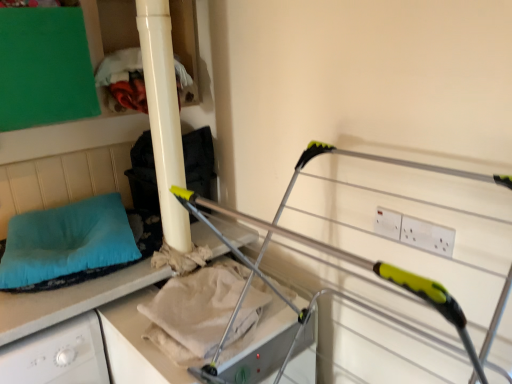
The image size is (512, 384). I want to click on beige cotton sheet at center, so click(x=194, y=312).

Measure the distance between point (135, 259) and camera.

The distance of point (135, 259) from camera is 4.75 feet.

This screenshot has height=384, width=512. Find the location of `metallic silver drying rack at center`. metallic silver drying rack at center is located at coordinates (361, 257).

Is matte white pillar at upper left not within teal fabric pillow at left?

matte white pillar at upper left lies outside teal fabric pillow at left's area.

Between matte white pillar at upper left and teal fabric pillow at left, which one appears on the right side from the viewer's perspective?

Positioned to the right is matte white pillar at upper left.

Between point (167, 243) and point (60, 262), which one is positioned behind?

Point (167, 243)

Is metallic silver drying rack at center turned away from beige cotton sheet at center?

No, metallic silver drying rack at center is not facing away from beige cotton sheet at center.

Does metallic silver drying rack at center lie behind beige cotton sheet at center?

No, it is in front of beige cotton sheet at center.

In the scene shown: What's the angular difference between metallic silver drying rack at center and beige cotton sheet at center's facing directions?

metallic silver drying rack at center and beige cotton sheet at center are facing 90.4 degrees away from each other.

Can you confirm if metallic silver drying rack at center is shorter than beige cotton sheet at center?

In fact, metallic silver drying rack at center may be taller than beige cotton sheet at center.

Which is closer to the camera, (178, 302) or (155, 133)?

Point (178, 302).

Can you confirm if beige cotton sheet at center is shorter than matte white pillar at upper left?

Correct, beige cotton sheet at center is not as tall as matte white pillar at upper left.

Is beige cotton sheet at center oriented away from matte white pillar at upper left?

No.

Which of these two, teal fabric pillow at left or beige cotton sheet at center, stands shorter?

Standing shorter between the two is beige cotton sheet at center.

Is beige cotton sheet at center completely or partially inside teal fabric pillow at left?

No, teal fabric pillow at left does not contain beige cotton sheet at center.

From a real-world perspective, relative to beige cotton sheet at center, is teal fabric pillow at left vertically above or below?

From a real-world perspective, teal fabric pillow at left is physically above beige cotton sheet at center.

Consider the image. Is teal fabric pillow at left positioned in front of beige cotton sheet at center?

No, it is not.

Considering the relative positions of teal fabric pillow at left and metallic silver drying rack at center in the image provided, is teal fabric pillow at left to the right of metallic silver drying rack at center from the viewer's perspective?

Incorrect, teal fabric pillow at left is not on the right side of metallic silver drying rack at center.

From the image's perspective, is teal fabric pillow at left above or below metallic silver drying rack at center?

From the image's perspective, teal fabric pillow at left appears above metallic silver drying rack at center.

From a real-world perspective, is teal fabric pillow at left beneath metallic silver drying rack at center?

Actually, teal fabric pillow at left is physically above metallic silver drying rack at center in the real world.

Considering the relative sizes of teal fabric pillow at left and metallic silver drying rack at center in the image provided, is teal fabric pillow at left taller than metallic silver drying rack at center?

In fact, teal fabric pillow at left may be shorter than metallic silver drying rack at center.

Between beige cotton sheet at center and metallic silver drying rack at center, which one has larger size?

metallic silver drying rack at center is bigger.

Measure the distance from beige cotton sheet at center to metallic silver drying rack at center.

beige cotton sheet at center and metallic silver drying rack at center are 15.31 inches apart.

Is metallic silver drying rack at center inside beige cotton sheet at center?

Actually, metallic silver drying rack at center is outside beige cotton sheet at center.

Considering the positions of objects matte white pillar at upper left and metallic silver drying rack at center in the image provided, who is more to the left, matte white pillar at upper left or metallic silver drying rack at center?

Positioned to the left is matte white pillar at upper left.

Do you think matte white pillar at upper left is within metallic silver drying rack at center, or outside of it?

matte white pillar at upper left is located beyond the bounds of metallic silver drying rack at center.

Is point (155, 168) farther from camera compared to point (293, 178)?

That is True.

Locate an element on the screen. Image resolution: width=512 pixels, height=384 pixels. pillow on the left of matte white pillar at upper left is located at coordinates (66, 241).

Find the location of a particular element. bunk bed that is above the beige cotton sheet at center (from a real-world perspective) is located at coordinates (361, 257).

Looking at the image, which one is located closer to teal fabric pillow at left, beige cotton sheet at center or matte white pillar at upper left?

Result: Based on the image, beige cotton sheet at center appears to be nearer to teal fabric pillow at left.

Which object lies nearer to the anchor point matte white pillar at upper left, teal fabric pillow at left or beige cotton sheet at center?

beige cotton sheet at center lies closer to matte white pillar at upper left than the other object.

Looking at the image, which one is located closer to matte white pillar at upper left, metallic silver drying rack at center or teal fabric pillow at left?

Among the two, teal fabric pillow at left is located nearer to matte white pillar at upper left.

From the image, which object appears to be nearer to matte white pillar at upper left, teal fabric pillow at left or metallic silver drying rack at center?

teal fabric pillow at left is closer to matte white pillar at upper left.

Based on the photo, when comparing their distances from metallic silver drying rack at center, does beige cotton sheet at center or matte white pillar at upper left seem further?

matte white pillar at upper left.

Considering their positions, is matte white pillar at upper left positioned further to teal fabric pillow at left than beige cotton sheet at center?

matte white pillar at upper left is positioned further to the anchor teal fabric pillow at left.

In the scene shown: Estimate the real-world distances between objects in this image. Which object is further from teal fabric pillow at left, metallic silver drying rack at center or beige cotton sheet at center?

Based on the image, metallic silver drying rack at center appears to be further to teal fabric pillow at left.

Looking at the image, which one is located closer to teal fabric pillow at left, metallic silver drying rack at center or matte white pillar at upper left?

matte white pillar at upper left lies closer to teal fabric pillow at left than the other object.

Find the location of a particular element. The width and height of the screenshot is (512, 384). pillow between matte white pillar at upper left and beige cotton sheet at center from top to bottom is located at coordinates click(66, 241).

You are a GUI agent. You are given a task and a screenshot of the screen. Output one action in this format:
    pyautogui.click(x=<x>, y=<y>)
    Task: Click on the sheet located between teal fabric pillow at left and metallic silver drying rack at center in the left-right direction
    
    Given the screenshot: What is the action you would take?
    pyautogui.click(x=194, y=312)

At what (x,y) coordinates should I click in order to perform the action: click on pillar between teal fabric pillow at left and metallic silver drying rack at center from left to right. Please return your answer as a coordinate pair (x, y). This screenshot has height=384, width=512. Looking at the image, I should click on (164, 117).

Locate an element on the screen. This screenshot has height=384, width=512. sheet positioned between metallic silver drying rack at center and matte white pillar at upper left from near to far is located at coordinates (194, 312).